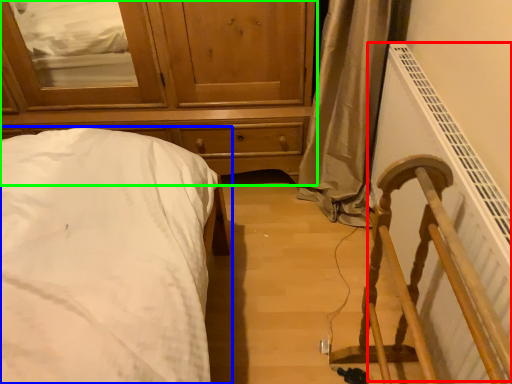
Question: Which object is positioned farthest from radiator (highlighted by a red box)? Select from bed (highlighted by a blue box) and chest of drawers (highlighted by a green box).

Choices:
 (A) bed
 (B) chest of drawers

Answer: (A)